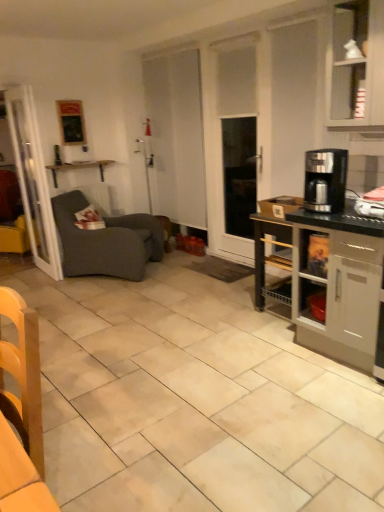
Question: From a real-world perspective, relative to white glossy cabinet at upper right, is wooden chair at lower left vertically above or below?

Choices:
 (A) above
 (B) below

Answer: (B)

Question: From the image's perspective, is wooden chair at lower left above or below white glossy cabinet at upper right?

Choices:
 (A) below
 (B) above

Answer: (A)

Question: Which of these objects is positioned farthest from the satin black coffee maker at right?

Choices:
 (A) wooden chair at lower left
 (B) wooden shelf at upper left
 (C) dark gray fabric studio couch at left
 (D) white glossy cabinet at upper right
 (E) transparent glass door at left

Answer: (B)

Question: Estimate the real-world distances between objects in this image. Which object is farther from the wooden chair at lower left?

Choices:
 (A) dark gray fabric studio couch at left
 (B) white glossy cabinet at upper right
 (C) wooden shelf at upper left
 (D) transparent glass door at left
 (E) black glossy coffee maker at right

Answer: (C)